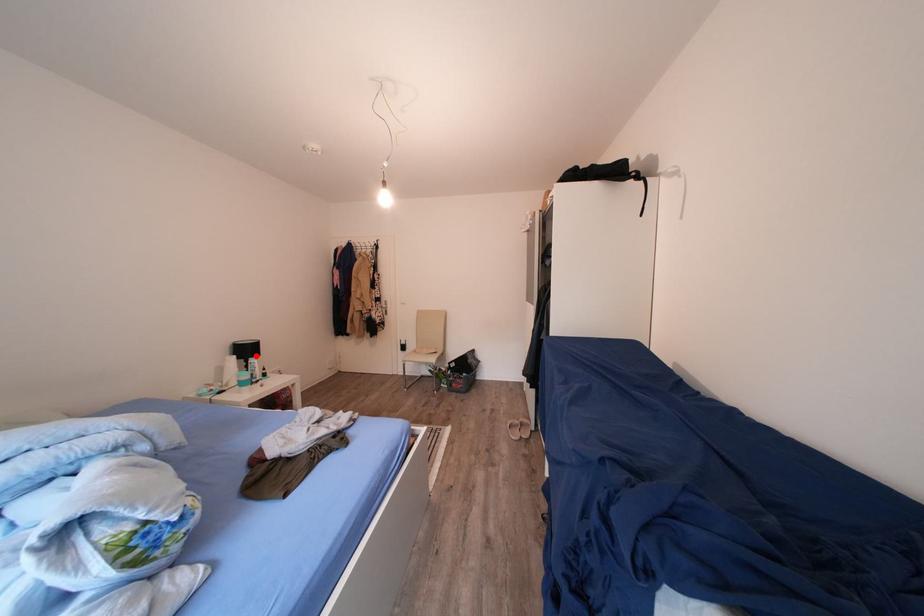
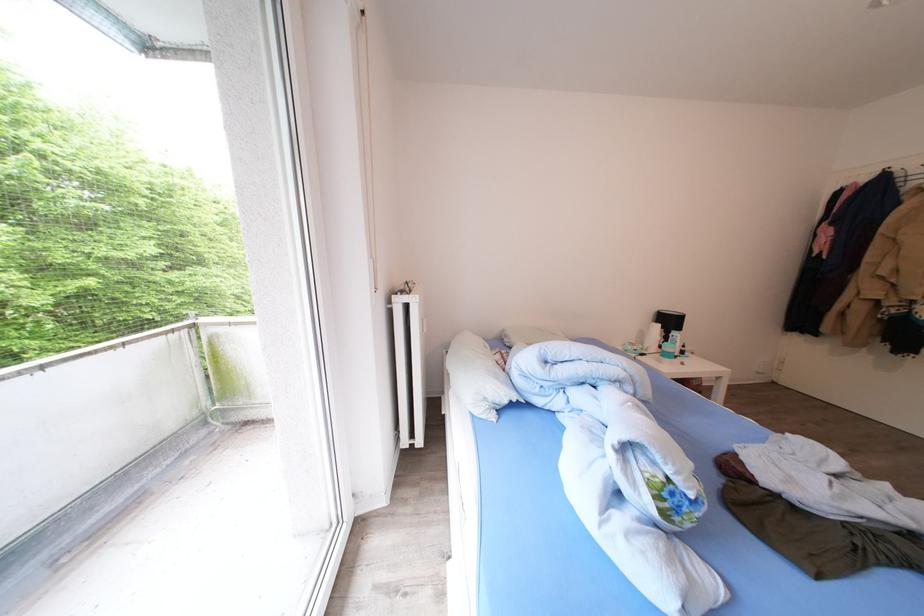
Question: I am providing you with two images of the same scene from different viewpoints. Image1 has a red point marked. In image2, the corresponding 3D location appears at what relative position? Reply with the corresponding letter.

Choices:
 (A) Closer
 (B) Farther

Answer: (B)